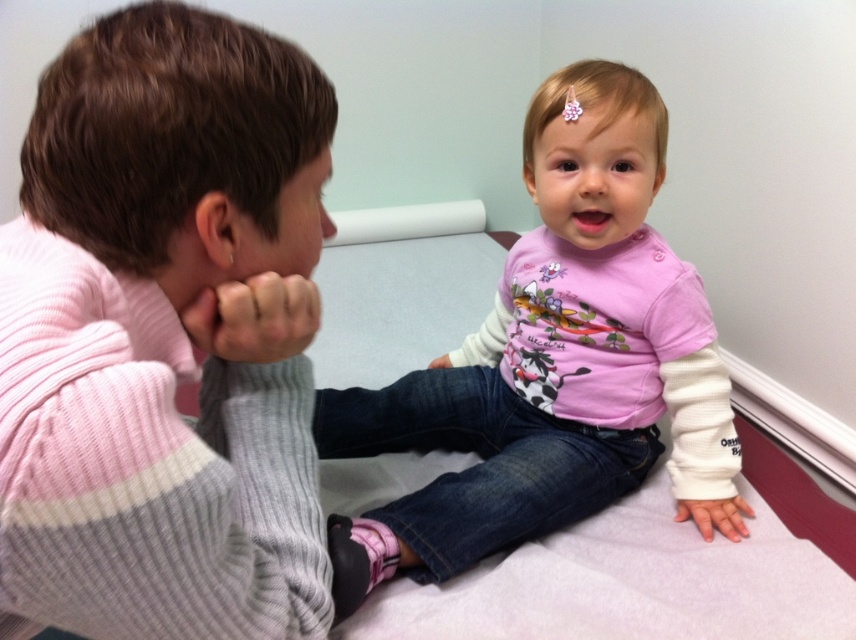
Is point (525, 396) closer to camera compared to point (711, 500)?

That is False.

Is pink matte shirt at center shorter than white matte hand at lower center?

No.

Is point (337, 394) positioned behind point (698, 509)?

That is True.

Image resolution: width=856 pixels, height=640 pixels. Identify the location of pink matte shirt at center. (548, 369).

Between pink ribbed sweater at left and matte gray sweater at left, which one is positioned higher?

Positioned higher is matte gray sweater at left.

Does pink ribbed sweater at left have a larger size compared to matte gray sweater at left?

Correct, pink ribbed sweater at left is larger in size than matte gray sweater at left.

Does point (265, 33) come in front of point (306, 282)?

Yes, it is in front of point (306, 282).

Identify the location of pink ribbed sweater at left. (165, 337).

Can you confirm if pink ribbed sweater at left is wider than pink matte shirt at center?

No, pink ribbed sweater at left is not wider than pink matte shirt at center.

Between pink ribbed sweater at left and pink matte shirt at center, which one has less height?

pink ribbed sweater at left

You are a GUI agent. You are given a task and a screenshot of the screen. Output one action in this format:
    pyautogui.click(x=<x>, y=<y>)
    Task: Click on the pink ribbed sweater at left
    Image resolution: width=856 pixels, height=640 pixels.
    Given the screenshot: What is the action you would take?
    pyautogui.click(x=165, y=337)